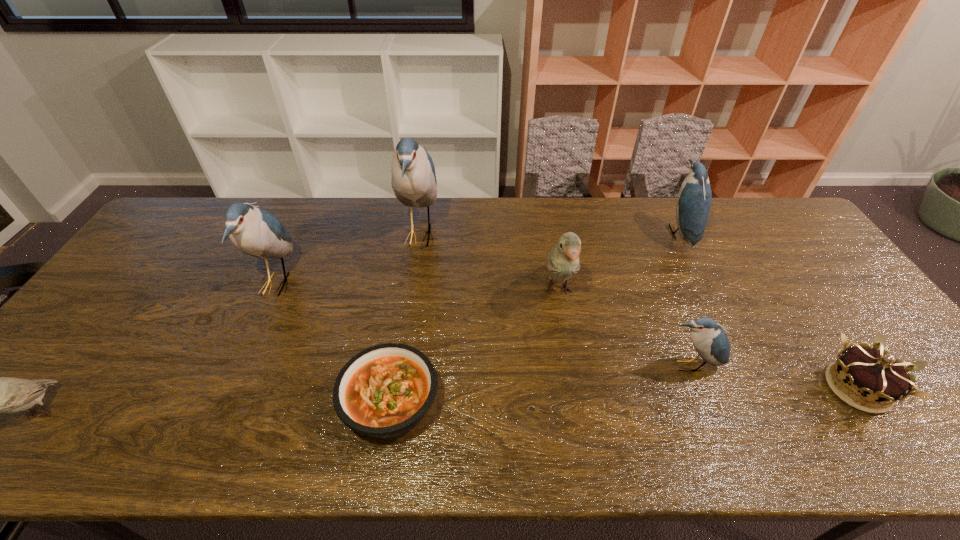
The width and height of the screenshot is (960, 540). In the image, there is a desktop. Find the location of `vacant region at the far left corner`. vacant region at the far left corner is located at coordinates (196, 237).

In the image, there is a desktop. At what (x,y) coordinates should I click in order to perform the action: click on vacant space at the near left corner. Please return your answer as a coordinate pair (x, y). Looking at the image, I should click on (8, 421).

Where is `unoccupied position between the gold crown and the shortest object`? unoccupied position between the gold crown and the shortest object is located at coordinates (624, 395).

This screenshot has height=540, width=960. Find the location of `vacant space that is in between the fifth shortest bird and the shortest object`. vacant space that is in between the fifth shortest bird and the shortest object is located at coordinates (333, 343).

Locate an element on the screen. The width and height of the screenshot is (960, 540). blank region between the right white bird and the second object from left to right is located at coordinates click(417, 287).

Identify the location of empty space between the shortest object and the crown. (624, 395).

Where is `unoccupied position between the smallest blue bird and the third bird from right to left`? The width and height of the screenshot is (960, 540). unoccupied position between the smallest blue bird and the third bird from right to left is located at coordinates pyautogui.click(x=624, y=328).

At what (x,y) coordinates should I click in order to perform the action: click on vacant region between the seventh object from right to left and the third biggest blue bird. Please return your answer as a coordinate pair (x, y). Image resolution: width=960 pixels, height=540 pixels. Looking at the image, I should click on (477, 258).

Find the location of a particular element. object that is the second closest to the rightmost blue bird is located at coordinates (708, 338).

This screenshot has width=960, height=540. I want to click on object that is the fifth nearest to the tallest object, so click(694, 198).